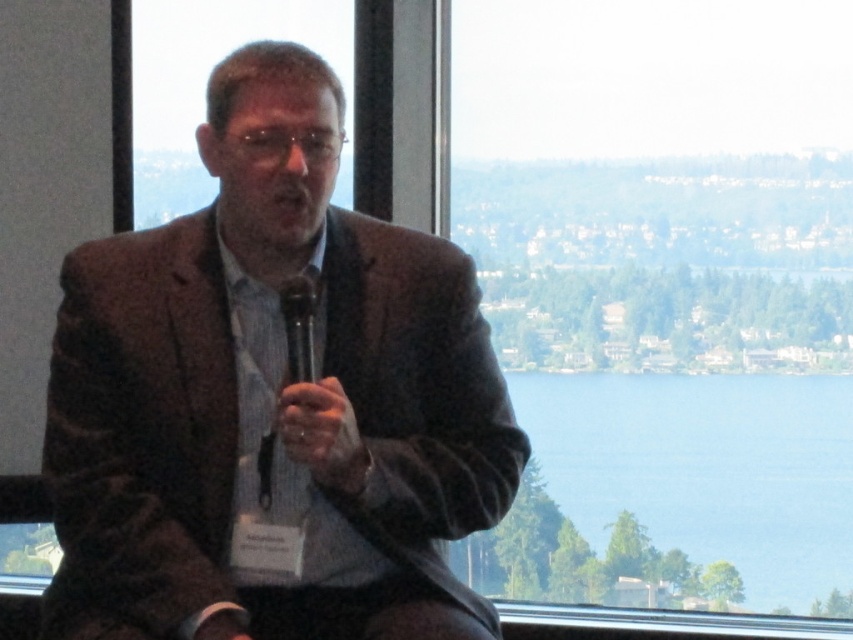
Does point (131, 620) come in front of point (314, 362)?

That is True.

Which is more to the left, textured brown blazer at center or black plastic microphone at center?

From the viewer's perspective, textured brown blazer at center appears more on the left side.

Does point (90, 340) lie behind point (297, 362)?

Yes, it is.

Image resolution: width=853 pixels, height=640 pixels. Find the location of `textured brown blazer at center`. textured brown blazer at center is located at coordinates (271, 401).

Can you confirm if blue water at center is taller than black plastic microphone at center?

Indeed, blue water at center has a greater height compared to black plastic microphone at center.

Does blue water at center have a smaller size compared to black plastic microphone at center?

No.

Is point (730, 515) farther from camera compared to point (305, 312)?

Yes.

Where is `blue water at center`? This screenshot has height=640, width=853. blue water at center is located at coordinates (676, 490).

Consider the image. Does textured brown blazer at center have a lesser width compared to blue water at center?

Correct, textured brown blazer at center's width is less than blue water at center's.

Is point (207, 588) positioned before point (641, 554)?

Yes, point (207, 588) is in front of point (641, 554).

Locate an element on the screen. textured brown blazer at center is located at coordinates (271, 401).

The width and height of the screenshot is (853, 640). In order to click on textured brown blazer at center in this screenshot , I will do `click(271, 401)`.